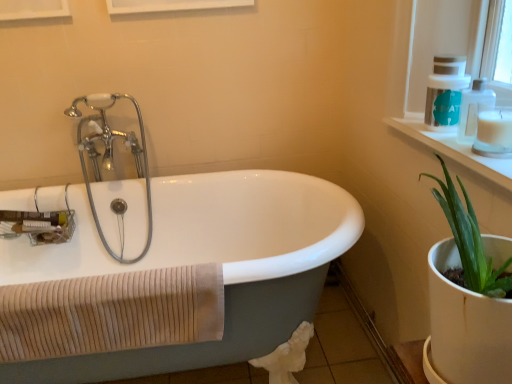
At what (x,y) coordinates should I click in order to perform the action: click on chrome/metallic faucet at upper left. Please return your answer as a coordinate pair (x, y). The image size is (512, 384). Looking at the image, I should click on (112, 155).

What is the approximate height of white glossy bathtub at center?

white glossy bathtub at center is 68.87 centimeters tall.

This screenshot has height=384, width=512. What do you see at coordinates (454, 149) in the screenshot?
I see `white glossy shelf at upper right` at bounding box center [454, 149].

Where is `white glossy shelf at upper right`? This screenshot has height=384, width=512. white glossy shelf at upper right is located at coordinates (454, 149).

At what (x,y) coordinates should I click in order to perform the action: click on white plastic window frame at upper right. Please return your answer as a coordinate pair (x, y). Looking at the image, I should click on (432, 68).

Can you tell me how much white plastic window frame at upper right and white matte candle at upper right differ in facing direction?

1.26 degrees.

Is white plastic window frame at upper right wider than white matte candle at upper right?

Yes, white plastic window frame at upper right is wider than white matte candle at upper right.

Looking at this image, from a real-world perspective, who is located lower, white plastic window frame at upper right or white matte candle at upper right?

white matte candle at upper right.

Between white plastic window frame at upper right and white matte candle at upper right, which one has less height?

Standing shorter between the two is white matte candle at upper right.

Can you tell me how much white plastic window frame at upper right and white glossy bathtub at center differ in facing direction?

90.4 degrees.

Is white glossy bathtub at center inside white plastic window frame at upper right?

No, white glossy bathtub at center is not inside white plastic window frame at upper right.

From a real-world perspective, who is located higher, white plastic window frame at upper right or white glossy bathtub at center?

white plastic window frame at upper right is physically above.

Considering the relative sizes of white plastic window frame at upper right and white glossy bathtub at center in the image provided, is white plastic window frame at upper right shorter than white glossy bathtub at center?

Correct, white plastic window frame at upper right is not as tall as white glossy bathtub at center.

From the image's perspective, is white plastic soap dispenser at upper right, acting as the 2th soap dispenser starting from the front, below white plastic window frame at upper right?

No, from the image's perspective, white plastic soap dispenser at upper right, acting as the 2th soap dispenser starting from the front, is not beneath white plastic window frame at upper right.

In terms of height, does white plastic soap dispenser at upper right, the 1th soap dispenser viewed from the back, look taller or shorter compared to white plastic window frame at upper right?

Clearly, white plastic soap dispenser at upper right, the 1th soap dispenser viewed from the back, is shorter compared to white plastic window frame at upper right.

In terms of width, does white plastic soap dispenser at upper right, the 1th soap dispenser viewed from the back, look wider or thinner when compared to white plastic window frame at upper right?

Considering their sizes, white plastic soap dispenser at upper right, the 1th soap dispenser viewed from the back, looks slimmer than white plastic window frame at upper right.

From a real-world perspective, between white plastic soap dispenser at upper right, acting as the 2th soap dispenser starting from the front, and white plastic window frame at upper right, who is vertically lower?

white plastic soap dispenser at upper right, acting as the 2th soap dispenser starting from the front.

Could you tell me if white plastic soap dispenser at upper right, the 1th soap dispenser viewed from the back, is turned towards white glossy bathtub at center?

No, white plastic soap dispenser at upper right, the 1th soap dispenser viewed from the back, is not turned towards white glossy bathtub at center.

Which of these two, white plastic soap dispenser at upper right, acting as the 2th soap dispenser starting from the front, or white glossy bathtub at center, stands shorter?

white plastic soap dispenser at upper right, acting as the 2th soap dispenser starting from the front.

Between white plastic soap dispenser at upper right, the 1th soap dispenser viewed from the back, and white glossy bathtub at center, which one has smaller size?

white plastic soap dispenser at upper right, the 1th soap dispenser viewed from the back, is smaller.

Choose the correct answer: Is white plastic soap dispenser at upper right, the 1th soap dispenser viewed from the back, inside white glossy bathtub at center or outside it?

white plastic soap dispenser at upper right, the 1th soap dispenser viewed from the back, is outside white glossy bathtub at center.

Is clear plastic soap dispenser at upper right, placed as the 2th soap dispenser when sorted from back to front, not near white glossy shelf at upper right?

clear plastic soap dispenser at upper right, placed as the 2th soap dispenser when sorted from back to front, is actually quite close to white glossy shelf at upper right.

How far apart are clear plastic soap dispenser at upper right, placed as the 2th soap dispenser when sorted from back to front, and white glossy shelf at upper right?

clear plastic soap dispenser at upper right, placed as the 2th soap dispenser when sorted from back to front, and white glossy shelf at upper right are 10.26 centimeters apart.

Can you tell me how much clear plastic soap dispenser at upper right, acting as the 1th soap dispenser starting from the front, and white glossy shelf at upper right differ in facing direction?

clear plastic soap dispenser at upper right, acting as the 1th soap dispenser starting from the front, and white glossy shelf at upper right are facing 1.5 degrees away from each other.

From a real-world perspective, is clear plastic soap dispenser at upper right, acting as the 1th soap dispenser starting from the front, beneath white glossy shelf at upper right?

No.

Could you tell me if chrome/metallic faucet at upper left is facing white glossy bathtub at center?

Yes, chrome/metallic faucet at upper left is facing white glossy bathtub at center.

Would you say chrome/metallic faucet at upper left contains white glossy bathtub at center?

That's incorrect, white glossy bathtub at center is not inside chrome/metallic faucet at upper left.

From a real-world perspective, is chrome/metallic faucet at upper left physically below white glossy bathtub at center?

No, from a real-world perspective, chrome/metallic faucet at upper left is not below white glossy bathtub at center.

How different are the orientations of chrome/metallic faucet at upper left and white glossy bathtub at center in degrees?

There is a 0.00074-degree angle between the facing directions of chrome/metallic faucet at upper left and white glossy bathtub at center.

Considering the relative sizes of white matte candle at upper right and clear plastic soap dispenser at upper right, placed as the 2th soap dispenser when sorted from back to front, in the image provided, is white matte candle at upper right thinner than clear plastic soap dispenser at upper right, placed as the 2th soap dispenser when sorted from back to front,?

Yes.

Identify the location of the 1st soap dispenser positioned above the white matte candle at upper right (from a real-world perspective). (474, 109).

Is white matte candle at upper right looking in the opposite direction of clear plastic soap dispenser at upper right, acting as the 1th soap dispenser starting from the front?

No, clear plastic soap dispenser at upper right, acting as the 1th soap dispenser starting from the front, is not at the back of white matte candle at upper right.

Locate an element on the screen. This screenshot has width=512, height=384. window frame positioned vertically above the white matte candle at upper right (from a real-world perspective) is located at coordinates (432, 68).

The height and width of the screenshot is (384, 512). Identify the location of bathtub to the left of white plastic window frame at upper right. (167, 270).

When comparing their distances from beige ribbed towel at lower left, does chrome/metallic faucet at upper left or white glossy bathtub at center seem further?

chrome/metallic faucet at upper left lies further to beige ribbed towel at lower left than the other object.

Estimate the real-world distances between objects in this image. Which object is further from white plastic window frame at upper right, chrome/metallic faucet at upper left or white plastic soap dispenser at upper right, acting as the 2th soap dispenser starting from the front?

The object further to white plastic window frame at upper right is chrome/metallic faucet at upper left.

From the image, which object appears to be farther from white matte candle at upper right, white glossy shelf at upper right or clear plastic soap dispenser at upper right, acting as the 1th soap dispenser starting from the front?

white glossy shelf at upper right lies further to white matte candle at upper right than the other object.

Considering their positions, is white matte candle at upper right positioned closer to clear plastic soap dispenser at upper right, acting as the 1th soap dispenser starting from the front, than white plastic window frame at upper right?

white matte candle at upper right is closer to clear plastic soap dispenser at upper right, acting as the 1th soap dispenser starting from the front.

Estimate the real-world distances between objects in this image. Which object is closer to white glossy shelf at upper right, chrome/metallic faucet at upper left or white plastic soap dispenser at upper right, acting as the 2th soap dispenser starting from the front?

white plastic soap dispenser at upper right, acting as the 2th soap dispenser starting from the front.

Based on their spatial positions, is chrome/metallic faucet at upper left or white glossy bathtub at center closer to white matte candle at upper right?

Among the two, white glossy bathtub at center is located nearer to white matte candle at upper right.

Based on their spatial positions, is beige ribbed towel at lower left or white plastic window frame at upper right further from white glossy bathtub at center?

The object further to white glossy bathtub at center is white plastic window frame at upper right.

Considering their positions, is white glossy shelf at upper right positioned closer to white glossy bathtub at center than chrome/metallic faucet at upper left?

chrome/metallic faucet at upper left lies closer to white glossy bathtub at center than the other object.

Where is `window frame situated between chrome/metallic faucet at upper left and clear plastic soap dispenser at upper right, placed as the 2th soap dispenser when sorted from back to front, from left to right`? This screenshot has height=384, width=512. window frame situated between chrome/metallic faucet at upper left and clear plastic soap dispenser at upper right, placed as the 2th soap dispenser when sorted from back to front, from left to right is located at coordinates (432, 68).

Locate an element on the screen. The image size is (512, 384). soap dispenser between white glossy bathtub at center and white glossy shelf at upper right in the horizontal direction is located at coordinates (445, 92).

The height and width of the screenshot is (384, 512). I want to click on window sill between white plastic window frame at upper right and white matte candle at upper right in the front-back direction, so [x=454, y=149].

Locate an element on the screen. window frame between beige ribbed towel at lower left and white matte candle at upper right in the horizontal direction is located at coordinates (432, 68).